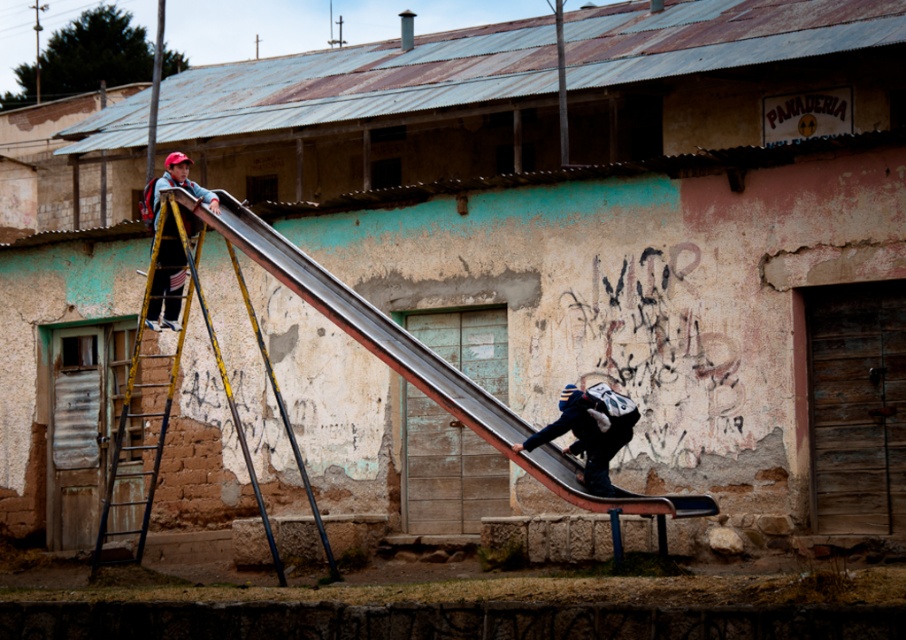
Question: Estimate the real-world distances between objects in this image. Which object is farther from the yellow metal ladder at upper left?

Choices:
 (A) metallic smooth slide at center
 (B) dark blue fabric backpack at lower right

Answer: (A)

Question: Which point is closer to the camera taking this photo?

Choices:
 (A) (182, 314)
 (B) (249, 221)
 (C) (571, 397)
 (D) (172, 269)

Answer: (C)

Question: From the image, what is the correct spatial relationship of yellow metal ladder at upper left in relation to dark blue fabric backpack at lower right?

Choices:
 (A) left
 (B) right

Answer: (A)

Question: Which object appears closest to the camera in this image?

Choices:
 (A) matte yellow ladder at left
 (B) yellow metal ladder at upper left

Answer: (B)

Question: Does metallic smooth slide at center appear over matte yellow ladder at left?

Choices:
 (A) yes
 (B) no

Answer: (B)

Question: Does metallic smooth slide at center appear over matte yellow ladder at left?

Choices:
 (A) yes
 (B) no

Answer: (B)